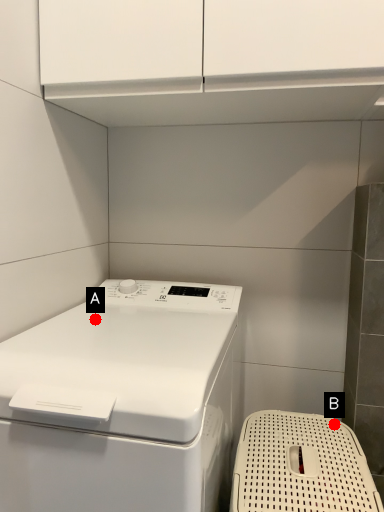
Question: Two points are circled on the image, labeled by A and B beside each circle. Which point appears farthest from the camera in this image?

Choices:
 (A) A is further
 (B) B is further

Answer: (B)